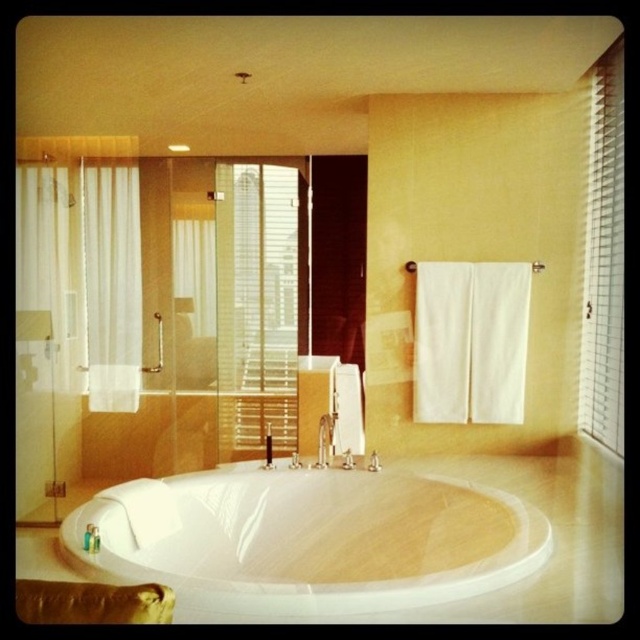
You are standing in the bathroom and want to open the white textured blinds at upper right. Based on their position, where should you reach to operate them?

The white textured blinds at upper right are located at point 0.405 on the x axis and 0.944 on the y axis, so you should reach towards the upper right corner of the bathroom wall near those coordinates to operate them.

From the picture: You are standing in the bathroom and want to adjust the white textured blinds at center. What are the exact coordinates where you should reach to operate them?

The white textured blinds at center are located at coordinates point (257, 305), so you should reach there to operate them.